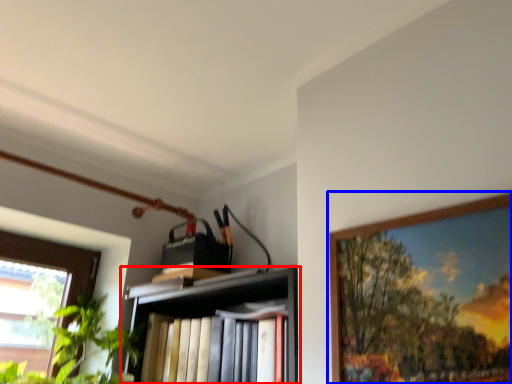
Question: Which object appears farthest to the camera in this image, shelf (highlighted by a red box) or picture frame (highlighted by a blue box)?

Choices:
 (A) shelf
 (B) picture frame

Answer: (A)